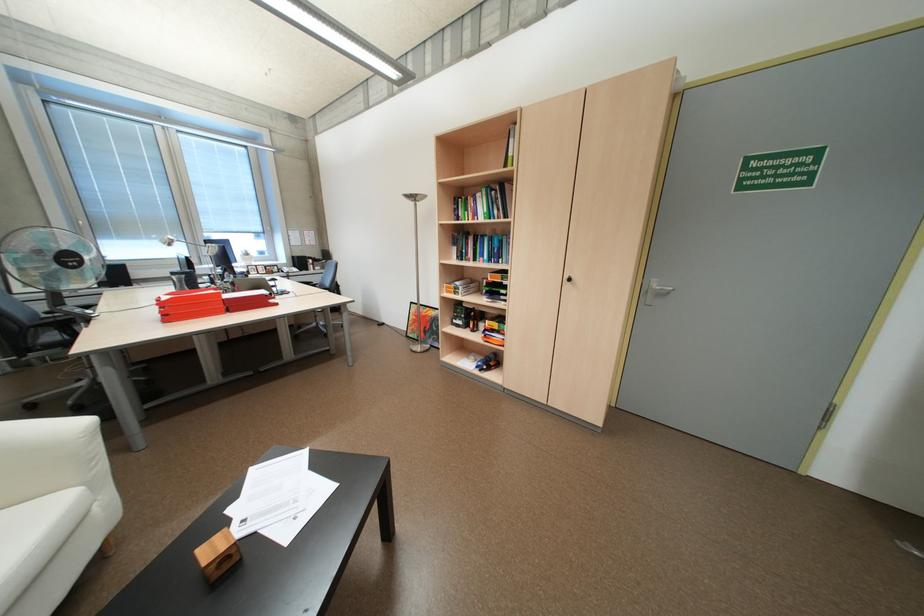
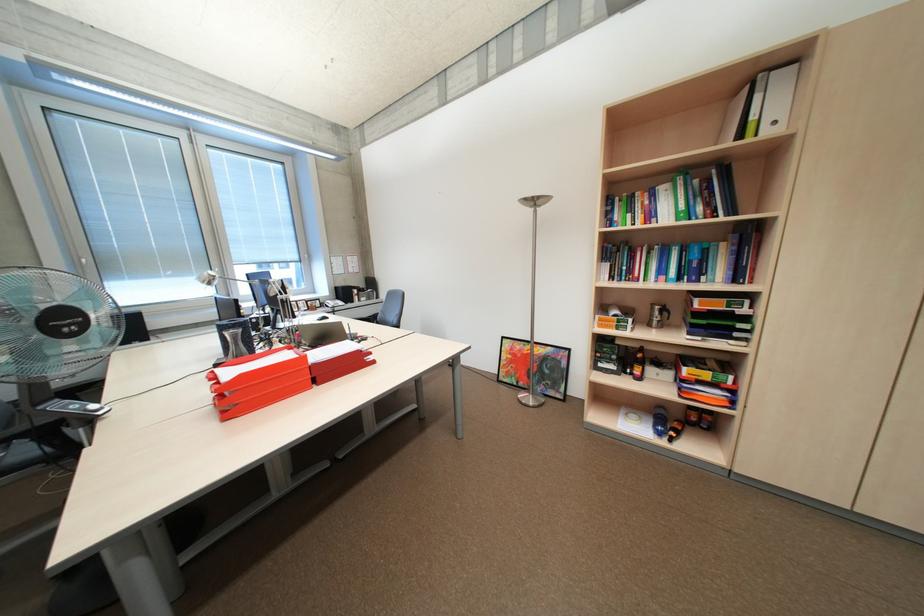
Where in the second image is the point corresponding to the point at 516,164 from the first image?

(749, 136)